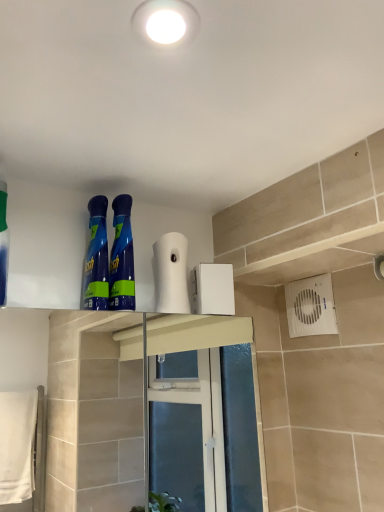
This screenshot has width=384, height=512. Describe the element at coordinates (165, 22) in the screenshot. I see `white glossy light fixture at upper center` at that location.

The width and height of the screenshot is (384, 512). Describe the element at coordinates (3, 244) in the screenshot. I see `green matte bottle at left, the first cleaning product viewed from the left` at that location.

Identify the location of white matte toilet paper at upper center. (171, 273).

Between blue glossy spray bottles at center, the third cleaning product positioned from the left, and white matte toilet paper at upper center, which one appears on the left side from the viewer's perspective?

blue glossy spray bottles at center, the third cleaning product positioned from the left, is more to the left.

How distant is blue glossy spray bottles at center, the third cleaning product positioned from the left, from white matte toilet paper at upper center?

The distance of blue glossy spray bottles at center, the third cleaning product positioned from the left, from white matte toilet paper at upper center is 9.81 centimeters.

From the image's perspective, is blue glossy spray bottles at center, the first cleaning product in the right-to-left sequence, located beneath white matte toilet paper at upper center?

No, from the image's perspective, blue glossy spray bottles at center, the first cleaning product in the right-to-left sequence, is not beneath white matte toilet paper at upper center.

Can we say blue glossy spray bottles at center, the first cleaning product in the right-to-left sequence, lies outside white matte toilet paper at upper center?

Absolutely, blue glossy spray bottles at center, the first cleaning product in the right-to-left sequence, is external to white matte toilet paper at upper center.

Which is less distant, (128, 258) or (151, 30)?

The point (151, 30) is in front.

How many degrees apart are the facing directions of blue glossy spray bottles at center, the first cleaning product in the right-to-left sequence, and white glossy light fixture at upper center?

The angular difference between blue glossy spray bottles at center, the first cleaning product in the right-to-left sequence, and white glossy light fixture at upper center is 87 degrees.

Is blue glossy spray bottles at center, the third cleaning product positioned from the left, positioned far away from white glossy light fixture at upper center?

Actually, blue glossy spray bottles at center, the third cleaning product positioned from the left, and white glossy light fixture at upper center are a little close together.

From a real-world perspective, is blue glossy spray bottles at center, the first cleaning product in the right-to-left sequence, positioned over white glossy light fixture at upper center based on gravity?

Incorrect, from a real-world perspective, blue glossy spray bottles at center, the first cleaning product in the right-to-left sequence, is lower than white glossy light fixture at upper center.

Considering the positions of objects blue glossy bottle at upper left, arranged as the second cleaning product when viewed from the left, and white matte toilet paper at upper center in the image provided, who is more to the right, blue glossy bottle at upper left, arranged as the second cleaning product when viewed from the left, or white matte toilet paper at upper center?

white matte toilet paper at upper center.

Based on the photo, which is nearer, (94, 249) or (185, 240)?

Point (94, 249)

Does blue glossy bottle at upper left, arranged as the second cleaning product when viewed from the left, have a greater height compared to white matte toilet paper at upper center?

Yes.

From the image's perspective, is blue glossy bottle at upper left, the second cleaning product positioned from the right, above white matte toilet paper at upper center?

Yes, from the image's perspective, blue glossy bottle at upper left, the second cleaning product positioned from the right, is over white matte toilet paper at upper center.

You are a GUI agent. You are given a task and a screenshot of the screen. Output one action in this format:
    pyautogui.click(x=<x>, y=<y>)
    Task: Click on the 2nd cleaning product to the left of the white matte toilet paper at upper center, starting your count from the anchor
    The width and height of the screenshot is (384, 512).
    Given the screenshot: What is the action you would take?
    pyautogui.click(x=96, y=259)

Is point (177, 253) closer to viewer compared to point (99, 275)?

No, it is not.

Considering the relative sizes of white matte toilet paper at upper center and blue glossy bottle at upper left, arranged as the second cleaning product when viewed from the left, in the image provided, is white matte toilet paper at upper center wider than blue glossy bottle at upper left, arranged as the second cleaning product when viewed from the left,?

In fact, white matte toilet paper at upper center might be narrower than blue glossy bottle at upper left, arranged as the second cleaning product when viewed from the left.

Would you consider white matte toilet paper at upper center to be distant from blue glossy bottle at upper left, arranged as the second cleaning product when viewed from the left?

white matte toilet paper at upper center is actually quite close to blue glossy bottle at upper left, arranged as the second cleaning product when viewed from the left.

Choose the correct answer: Is white glossy light fixture at upper center inside white matte toilet paper at upper center or outside it?

white glossy light fixture at upper center is outside white matte toilet paper at upper center.

Considering the points (141, 3) and (169, 279), which point is in front, point (141, 3) or point (169, 279)?

The point (141, 3) is closer to the camera.

Who is taller, white glossy light fixture at upper center or white matte toilet paper at upper center?

Standing taller between the two is white matte toilet paper at upper center.

Which object is positioned more to the right, white glossy light fixture at upper center or white matte toilet paper at upper center?

white glossy light fixture at upper center is more to the right.

Is green matte bottle at left, the first cleaning product viewed from the left, oriented towards white matte toilet paper at upper center?

No.

Does green matte bottle at left, the first cleaning product viewed from the left, lie in front of white matte toilet paper at upper center?

Yes, it is in front of white matte toilet paper at upper center.

Locate an element on the screen. toilet paper behind the green matte bottle at left, acting as the third cleaning product starting from the right is located at coordinates (171, 273).

Looking at this image, does green matte bottle at left, acting as the third cleaning product starting from the right, have a smaller size compared to white matte toilet paper at upper center?

No, green matte bottle at left, acting as the third cleaning product starting from the right, is not smaller than white matte toilet paper at upper center.

How many degrees apart are the facing directions of blue glossy bottle at upper left, the second cleaning product positioned from the right, and white glossy light fixture at upper center?

The facing directions of blue glossy bottle at upper left, the second cleaning product positioned from the right, and white glossy light fixture at upper center are 87 degrees apart.

Is blue glossy bottle at upper left, the second cleaning product positioned from the right, not close to white glossy light fixture at upper center?

That's not correct — blue glossy bottle at upper left, the second cleaning product positioned from the right, is a little close to white glossy light fixture at upper center.

Between blue glossy bottle at upper left, arranged as the second cleaning product when viewed from the left, and white glossy light fixture at upper center, which one has larger width?

white glossy light fixture at upper center.

Which object is positioned more to the right, blue glossy bottle at upper left, the second cleaning product positioned from the right, or white glossy light fixture at upper center?

From the viewer's perspective, white glossy light fixture at upper center appears more on the right side.

From the image's perspective, which cleaning product is the 2nd one above the white matte toilet paper at upper center? Please provide its 2D coordinates.

[(122, 257)]

At what (x,y) coordinates should I click in order to perform the action: click on lighting in front of the blue glossy spray bottles at center, the first cleaning product in the right-to-left sequence. Please return your answer as a coordinate pair (x, y). The height and width of the screenshot is (512, 384). Looking at the image, I should click on (165, 22).

Consider the image. Which object lies further to the anchor point white glossy light fixture at upper center, blue glossy bottle at upper left, arranged as the second cleaning product when viewed from the left, or white matte toilet paper at upper center?

The object further to white glossy light fixture at upper center is white matte toilet paper at upper center.

Based on their spatial positions, is white glossy light fixture at upper center or green matte bottle at left, acting as the third cleaning product starting from the right, further from blue glossy spray bottles at center, the third cleaning product positioned from the left?

Among the two, white glossy light fixture at upper center is located further to blue glossy spray bottles at center, the third cleaning product positioned from the left.

Based on their spatial positions, is blue glossy bottle at upper left, the second cleaning product positioned from the right, or white matte toilet paper at upper center closer to blue glossy spray bottles at center, the first cleaning product in the right-to-left sequence?

→ Based on the image, blue glossy bottle at upper left, the second cleaning product positioned from the right, appears to be nearer to blue glossy spray bottles at center, the first cleaning product in the right-to-left sequence.

Estimate the real-world distances between objects in this image. Which object is closer to white matte toilet paper at upper center, blue glossy spray bottles at center, the third cleaning product positioned from the left, or blue glossy bottle at upper left, the second cleaning product positioned from the right?

blue glossy spray bottles at center, the third cleaning product positioned from the left, lies closer to white matte toilet paper at upper center than the other object.

From the image, which object appears to be nearer to green matte bottle at left, the first cleaning product viewed from the left, white matte toilet paper at upper center or blue glossy spray bottles at center, the third cleaning product positioned from the left?

The object closer to green matte bottle at left, the first cleaning product viewed from the left, is blue glossy spray bottles at center, the third cleaning product positioned from the left.

Estimate the real-world distances between objects in this image. Which object is further from blue glossy bottle at upper left, arranged as the second cleaning product when viewed from the left, white glossy light fixture at upper center or white matte toilet paper at upper center?

white glossy light fixture at upper center is further to blue glossy bottle at upper left, arranged as the second cleaning product when viewed from the left.

Based on their spatial positions, is white matte toilet paper at upper center or blue glossy spray bottles at center, the first cleaning product in the right-to-left sequence, further from white glossy light fixture at upper center?

Based on the image, white matte toilet paper at upper center appears to be further to white glossy light fixture at upper center.

When comparing their distances from white matte toilet paper at upper center, does white glossy light fixture at upper center or blue glossy spray bottles at center, the first cleaning product in the right-to-left sequence, seem further?

white glossy light fixture at upper center is further to white matte toilet paper at upper center.

This screenshot has height=512, width=384. In order to click on cleaning product between blue glossy bottle at upper left, the second cleaning product positioned from the right, and white matte toilet paper at upper center in this screenshot , I will do [x=122, y=257].

Where is `cleaning product located between green matte bottle at left, acting as the third cleaning product starting from the right, and blue glossy spray bottles at center, the first cleaning product in the right-to-left sequence, in the left-right direction`? This screenshot has width=384, height=512. cleaning product located between green matte bottle at left, acting as the third cleaning product starting from the right, and blue glossy spray bottles at center, the first cleaning product in the right-to-left sequence, in the left-right direction is located at coordinates (96, 259).

Identify the location of cleaning product positioned between white glossy light fixture at upper center and blue glossy spray bottles at center, the third cleaning product positioned from the left, from near to far. This screenshot has height=512, width=384. (3, 244).